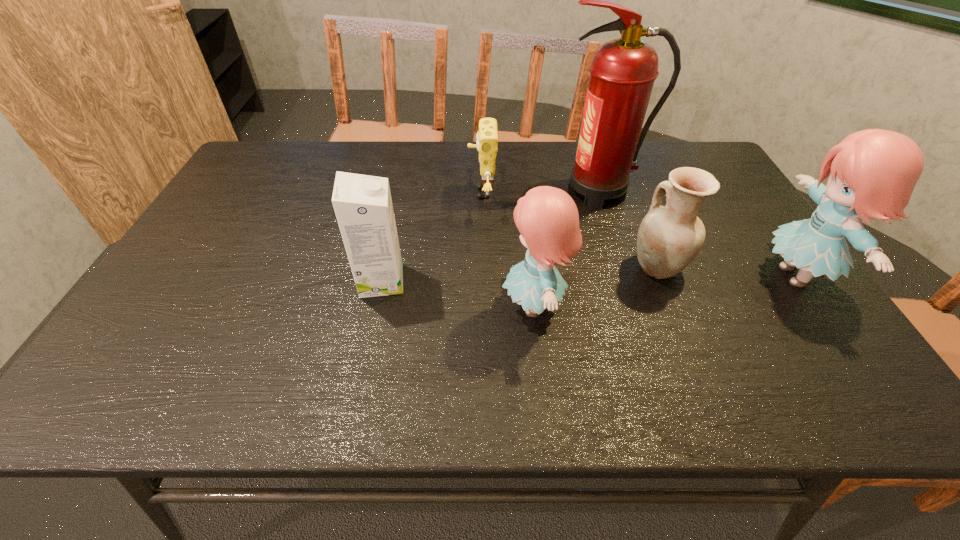
Locate an element on the screen. vacant space located on the front-facing side of the left doll is located at coordinates (357, 306).

Where is `vacant space located 0.150m on the front-facing side of the left doll`? vacant space located 0.150m on the front-facing side of the left doll is located at coordinates (436, 306).

You are a GUI agent. You are given a task and a screenshot of the screen. Output one action in this format:
    pyautogui.click(x=<x>, y=<y>)
    Task: Click on the free space located 0.250m on the front-facing side of the taller doll
    This screenshot has height=540, width=960.
    Given the screenshot: What is the action you would take?
    pyautogui.click(x=655, y=275)

Locate an element on the screen. free location located on the front-facing side of the taller doll is located at coordinates (712, 275).

The image size is (960, 540). I want to click on vacant space located on the front-facing side of the taller doll, so (x=663, y=275).

The height and width of the screenshot is (540, 960). I want to click on free space located 0.170m on the front-facing side of the fire extinguisher, so click(496, 191).

You are a GUI agent. You are given a task and a screenshot of the screen. Output one action in this format:
    pyautogui.click(x=<x>, y=<y>)
    Task: Click on the free region located on the front-facing side of the fire extinguisher
    The height and width of the screenshot is (540, 960).
    Given the screenshot: What is the action you would take?
    [x=476, y=191]

Where is `vacant space located 0.290m on the front-facing side of the fire extinguisher`? The width and height of the screenshot is (960, 540). vacant space located 0.290m on the front-facing side of the fire extinguisher is located at coordinates (456, 191).

This screenshot has height=540, width=960. I want to click on vacant space located 0.360m on the face of the shortest object, so click(348, 193).

Where is `vacant space located on the face of the shortest object`? vacant space located on the face of the shortest object is located at coordinates (378, 193).